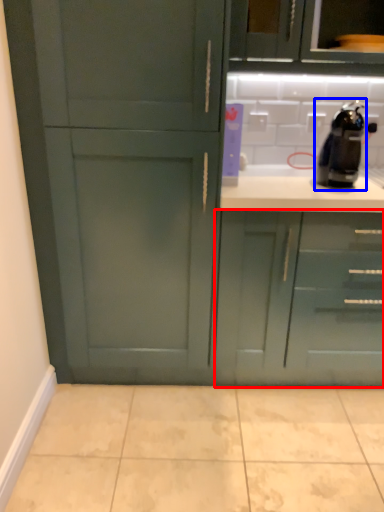
Question: Among these objects, which one is farthest to the camera, cabinetry (highlighted by a red box) or coffee machine (highlighted by a blue box)?

Choices:
 (A) cabinetry
 (B) coffee machine

Answer: (A)